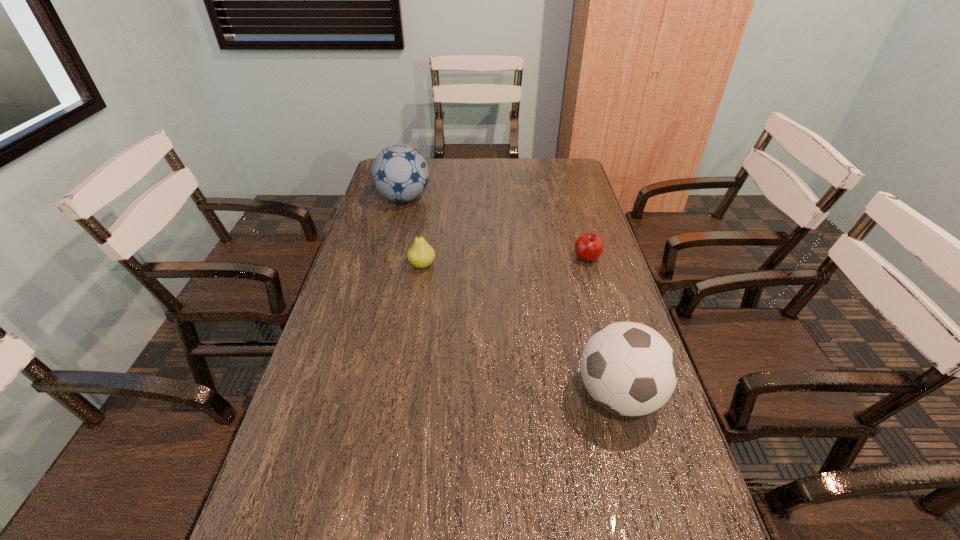
Locate an element on the screen. Image resolution: width=960 pixels, height=540 pixels. free space that satisfies the following two spatial constraints: 1. on the side with brand of the nearer soccer ball; 2. on the left side of the farthest object is located at coordinates (355, 395).

This screenshot has width=960, height=540. In order to click on vacant space that satisfies the following two spatial constraints: 1. on the side with brand of the left soccer ball; 2. on the back side of the shortest object in this screenshot , I will do 389,258.

Identify the location of free space that satisfies the following two spatial constraints: 1. on the side with brand of the farthest object; 2. on the back side of the right soccer ball. The image size is (960, 540). (355, 395).

Identify the location of vacant space that satisfies the following two spatial constraints: 1. on the side with brand of the nearest object; 2. on the right side of the left soccer ball. (355, 395).

Image resolution: width=960 pixels, height=540 pixels. Find the location of `free space in the image that satisfies the following two spatial constraints: 1. on the side with brand of the farthest object; 2. on the left side of the apple`. free space in the image that satisfies the following two spatial constraints: 1. on the side with brand of the farthest object; 2. on the left side of the apple is located at coordinates (389, 258).

This screenshot has height=540, width=960. I want to click on free space that satisfies the following two spatial constraints: 1. on the side with brand of the shortest object; 2. on the left side of the farther soccer ball, so click(389, 258).

Find the location of a particular element. The width and height of the screenshot is (960, 540). vacant region that satisfies the following two spatial constraints: 1. on the side with brand of the farther soccer ball; 2. on the back side of the right soccer ball is located at coordinates (355, 395).